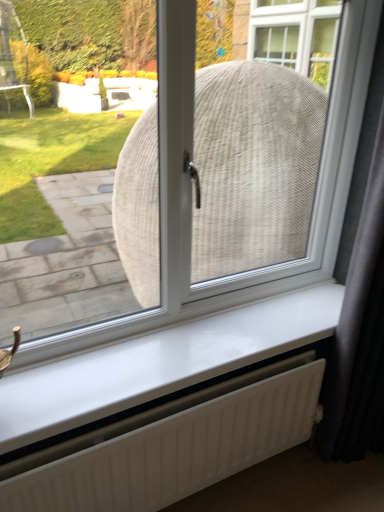
Question: Does white glossy window sill at center appear on the right side of black fabric curtain at right?

Choices:
 (A) yes
 (B) no

Answer: (B)

Question: Is white glossy window sill at center closer to camera compared to black fabric curtain at right?

Choices:
 (A) yes
 (B) no

Answer: (B)

Question: From the image's perspective, is white glossy window sill at center located beneath black fabric curtain at right?

Choices:
 (A) yes
 (B) no

Answer: (A)

Question: Considering the relative sizes of white glossy window sill at center and black fabric curtain at right in the image provided, is white glossy window sill at center thinner than black fabric curtain at right?

Choices:
 (A) yes
 (B) no

Answer: (A)

Question: Considering the relative sizes of white glossy window sill at center and black fabric curtain at right in the image provided, is white glossy window sill at center bigger than black fabric curtain at right?

Choices:
 (A) yes
 (B) no

Answer: (B)

Question: Could black fabric curtain at right be considered to be inside white glossy window sill at center?

Choices:
 (A) yes
 (B) no

Answer: (B)

Question: Can you confirm if white matte radiator at lower center is smaller than white glossy window sill at center?

Choices:
 (A) yes
 (B) no

Answer: (B)

Question: Is white glossy window sill at center inside white matte radiator at lower center?

Choices:
 (A) no
 (B) yes

Answer: (A)

Question: Is white matte radiator at lower center looking in the opposite direction of white glossy window sill at center?

Choices:
 (A) no
 (B) yes

Answer: (A)

Question: From a real-world perspective, does white matte radiator at lower center stand above white glossy window sill at center?

Choices:
 (A) no
 (B) yes

Answer: (A)

Question: Considering the relative sizes of white matte radiator at lower center and white glossy window sill at center in the image provided, is white matte radiator at lower center wider than white glossy window sill at center?

Choices:
 (A) no
 (B) yes

Answer: (A)

Question: Is white matte radiator at lower center to the left of white glossy window sill at center from the viewer's perspective?

Choices:
 (A) yes
 (B) no

Answer: (B)

Question: Could you tell me if black fabric curtain at right is turned towards white matte radiator at lower center?

Choices:
 (A) yes
 (B) no

Answer: (B)